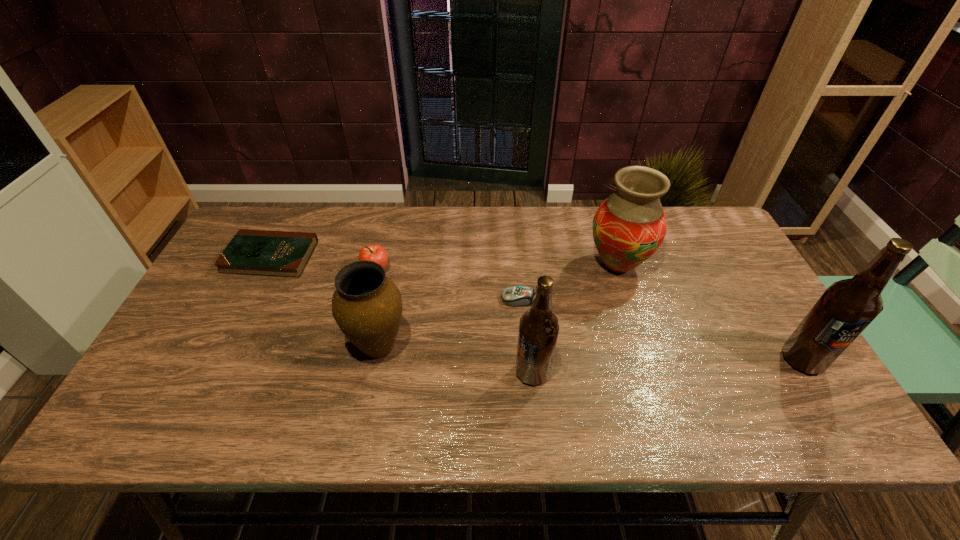
At what (x,y) coordinates should I click in order to perform the action: click on free point that keeps the beer bottles evenly spaced on the left. Please return your answer as a coordinate pair (x, y). Image resolution: width=960 pixels, height=540 pixels. Looking at the image, I should click on (249, 386).